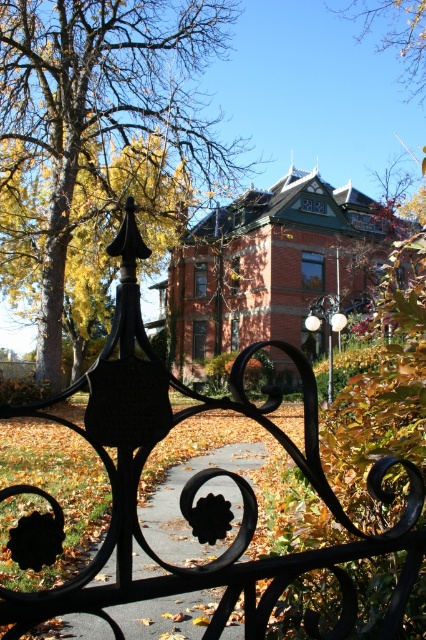
Is dark gray concrete path at center below brown leafy tree at upper center?

Yes, dark gray concrete path at center is below brown leafy tree at upper center.

Between dark gray concrete path at center and brown leafy tree at upper center, which one appears on the left side from the viewer's perspective?

From the viewer's perspective, dark gray concrete path at center appears more on the left side.

Who is more forward, [166,634] or [411,86]?

Point [166,634] is more forward.

Find the location of `dark gray concrete path at center`. dark gray concrete path at center is located at coordinates (195, 502).

Which is in front, point (193, 68) or point (412, 44)?

Positioned in front is point (193, 68).

Does brown leafy tree at upper left have a greater width compared to brown leafy tree at upper center?

Correct, the width of brown leafy tree at upper left exceeds that of brown leafy tree at upper center.

Describe the element at coordinates (98, 115) in the screenshot. This screenshot has width=426, height=640. I see `brown leafy tree at upper left` at that location.

Where is `brown leafy tree at upper left`? brown leafy tree at upper left is located at coordinates (98, 115).

Is brown leafy tree at upper left below dark gray concrete path at center?

Actually, brown leafy tree at upper left is above dark gray concrete path at center.

Is point (203, 131) positioned before point (173, 467)?

No, it is not.

Find the location of a particular element. The height and width of the screenshot is (640, 426). brown leafy tree at upper left is located at coordinates (98, 115).